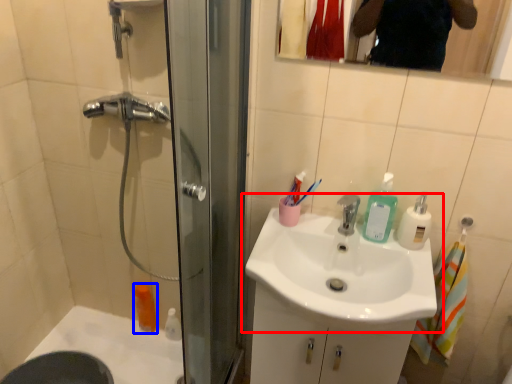
Question: Which point is further to the camera, sink (highlighted by a red box) or mouthwash (highlighted by a blue box)?

Choices:
 (A) sink
 (B) mouthwash

Answer: (B)